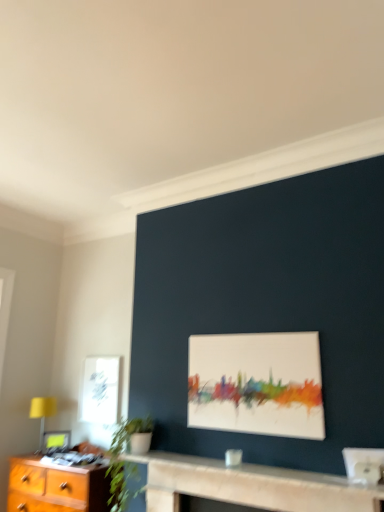
Question: Is the position of smooth stone fireplace at center less distant than that of white matte painting at center, which appears as the 2th picture frame when viewed from the left?

Choices:
 (A) no
 (B) yes

Answer: (B)

Question: Is smooth stone fireplace at center facing towards white matte painting at center, arranged as the 2th picture frame when ordered from the bottom?

Choices:
 (A) yes
 (B) no

Answer: (B)

Question: From the image's perspective, would you say smooth stone fireplace at center is shown under white matte painting at center, positioned as the 1th picture frame in front-to-back order?

Choices:
 (A) no
 (B) yes

Answer: (B)

Question: Is white matte painting at center, which appears as the 2th picture frame when viewed from the left, located within smooth stone fireplace at center?

Choices:
 (A) yes
 (B) no

Answer: (B)

Question: Is smooth stone fireplace at center looking in the opposite direction of white matte painting at center, which appears as the 2th picture frame when viewed from the left?

Choices:
 (A) yes
 (B) no

Answer: (B)

Question: In terms of size, does green leafy plant at lower left appear bigger or smaller than matte black picture frame at lower left, arranged as the 1th picture frame when viewed from the back?

Choices:
 (A) small
 (B) big

Answer: (B)

Question: Looking at their shapes, would you say green leafy plant at lower left is wider or thinner than matte black picture frame at lower left, arranged as the 1th picture frame when viewed from the back?

Choices:
 (A) thin
 (B) wide

Answer: (B)

Question: Would you say green leafy plant at lower left is inside or outside matte black picture frame at lower left, the first picture frame viewed from the left?

Choices:
 (A) inside
 (B) outside

Answer: (B)

Question: From a real-world perspective, is green leafy plant at lower left physically located above or below matte black picture frame at lower left, arranged as the first picture frame when ordered from the bottom?

Choices:
 (A) below
 (B) above

Answer: (A)

Question: Relative to white matte painting at center, which appears as the 2th picture frame when viewed from the left, is white paper at upper left in front or behind?

Choices:
 (A) behind
 (B) front

Answer: (A)

Question: Would you say white paper at upper left is inside or outside white matte painting at center, which appears as the 2th picture frame when viewed from the left?

Choices:
 (A) outside
 (B) inside

Answer: (A)

Question: Is white paper at upper left bigger or smaller than white matte painting at center, arranged as the 2th picture frame when viewed from the back?

Choices:
 (A) big
 (B) small

Answer: (B)

Question: From the image's perspective, is white paper at upper left above or below white matte painting at center, which appears as the 2th picture frame when viewed from the left?

Choices:
 (A) above
 (B) below

Answer: (B)

Question: Is white matte painting at center, positioned as the 1th picture frame in front-to-back order, spatially inside white paper at upper left, or outside of it?

Choices:
 (A) inside
 (B) outside

Answer: (B)

Question: In the image, is white matte painting at center, marked as the 1th picture frame in a right-to-left arrangement, positioned in front of or behind white paper at upper left?

Choices:
 (A) behind
 (B) front

Answer: (B)